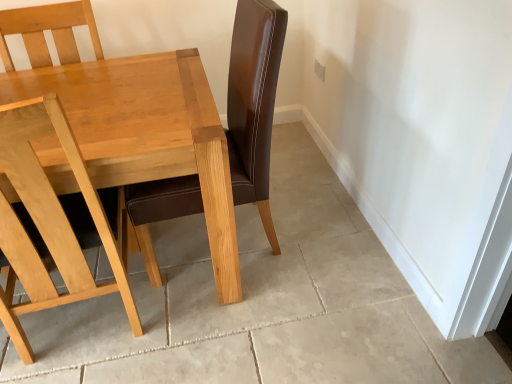
The height and width of the screenshot is (384, 512). Describe the element at coordinates (53, 221) in the screenshot. I see `light wood chair at left` at that location.

Identify the location of light wood chair at left. (53, 221).

Where is `light wood table at center`? The width and height of the screenshot is (512, 384). light wood table at center is located at coordinates (147, 133).

This screenshot has width=512, height=384. Describe the element at coordinates (147, 133) in the screenshot. I see `light wood table at center` at that location.

You are a GUI agent. You are given a task and a screenshot of the screen. Output one action in this format:
    pyautogui.click(x=<x>, y=<y>)
    Task: Click on the light wood chair at left
    This screenshot has width=512, height=384.
    Given the screenshot: What is the action you would take?
    pyautogui.click(x=53, y=221)

Between light wood chair at left and light wood table at center, which one appears on the left side from the viewer's perspective?

light wood table at center.

In the image, is light wood chair at left positioned in front of or behind light wood table at center?

light wood chair at left is positioned closer to the viewer than light wood table at center.

Is point (54, 205) positioned behind point (151, 120)?

No, it is not.

From the image's perspective, is light wood chair at left positioned above or below light wood table at center?

From the image's perspective, light wood chair at left appears below light wood table at center.

From a real-world perspective, between light wood chair at left and light wood table at center, who is vertically higher?

In real-world perspective, light wood chair at left is above.

Which of these two, light wood chair at left or light wood table at center, is thinner?

light wood chair at left is thinner.

Who is taller, light wood chair at left or light wood table at center?

light wood chair at left.

Looking at the image, does light wood chair at left seem bigger or smaller compared to light wood table at center?

Considering their sizes, light wood chair at left takes up less space than light wood table at center.

Based on the photo, would you say light wood chair at left is inside or outside light wood table at center?

light wood chair at left can be found inside light wood table at center.

Are light wood chair at left and light wood table at center located far from each other?

They are positioned close to each other.

Does light wood chair at left turn towards light wood table at center?

Yes, light wood chair at left is oriented towards light wood table at center.

What's the angular difference between light wood chair at left and light wood table at center's facing directions?

The angular difference between light wood chair at left and light wood table at center is 180 degrees.

Consider the image. How distant is light wood chair at left from light wood table at center?

light wood chair at left and light wood table at center are 12.66 inches apart.

Image resolution: width=512 pixels, height=384 pixels. Find the location of `table above the light wood chair at left (from the image's perspective)`. table above the light wood chair at left (from the image's perspective) is located at coordinates (147, 133).

Between light wood table at center and light wood chair at left, which one appears on the left side from the viewer's perspective?

light wood table at center is more to the left.

Between light wood table at center and light wood chair at left, which one is positioned in front?

light wood chair at left is more forward.

Which is nearer, (121,147) or (73,246)?

The point (121,147) is closer.

From the image's perspective, is light wood table at center above light wood chair at left?

Yes.

From a real-world perspective, is light wood table at center beneath light wood chair at left?

Yes, from a real-world perspective, light wood table at center is beneath light wood chair at left.

Which object is thinner, light wood table at center or light wood chair at left?

With smaller width is light wood chair at left.

Does light wood table at center have a lesser height compared to light wood chair at left?

Yes, light wood table at center is shorter than light wood chair at left.

Is light wood table at center bigger than light wood chair at left?

Yes, light wood table at center is bigger than light wood chair at left.

Does light wood table at center contain light wood chair at left?

That's correct, light wood chair at left is inside light wood table at center.

Are light wood table at center and light wood chair at left located far from each other?

That's not correct — light wood table at center is a little close to light wood chair at left.

Is light wood table at center aimed at light wood chair at left?

Yes.

In the scene shown: How different are the orientations of light wood table at center and light wood chair at left in degrees?

They differ by 180 degrees in their facing directions.

Measure the distance from light wood table at center to light wood chair at left.

light wood table at center is 12.66 inches from light wood chair at left.

Where is `chair below the light wood table at center (from the image's perspective)`? This screenshot has height=384, width=512. chair below the light wood table at center (from the image's perspective) is located at coordinates (53, 221).

The height and width of the screenshot is (384, 512). In order to click on chair in front of the light wood table at center in this screenshot , I will do `click(53, 221)`.

The image size is (512, 384). Find the location of `chair on the right of light wood table at center`. chair on the right of light wood table at center is located at coordinates (53, 221).